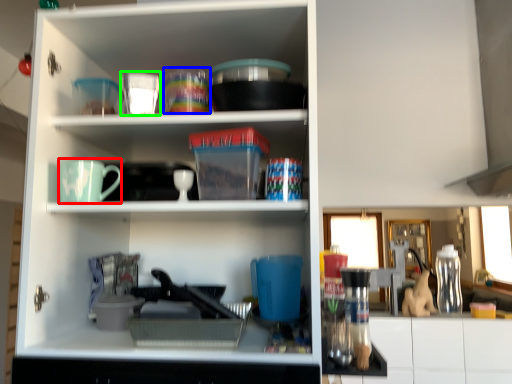
Question: Based on their relative distances, which object is farther from mug (highlighted by a red box)? Choose from tableware (highlighted by a blue box) and tableware (highlighted by a green box).

Choices:
 (A) tableware
 (B) tableware

Answer: (A)